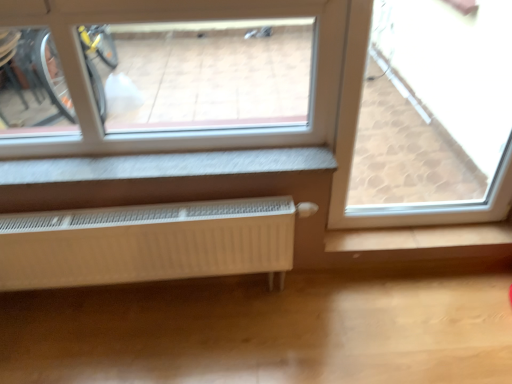
Question: Do you think white matte radiator at lower center is within transparent glass window at upper right, or outside of it?

Choices:
 (A) outside
 (B) inside

Answer: (A)

Question: Looking at the image, does white matte radiator at lower center seem bigger or smaller compared to transparent glass window at upper right?

Choices:
 (A) big
 (B) small

Answer: (B)

Question: From the image's perspective, is white matte radiator at lower center above or below transparent glass window at upper right?

Choices:
 (A) above
 (B) below

Answer: (B)

Question: Is transparent glass window at upper right taller or shorter than white matte radiator at lower center?

Choices:
 (A) short
 (B) tall

Answer: (B)

Question: Based on their sizes in the image, would you say transparent glass window at upper right is bigger or smaller than white matte radiator at lower center?

Choices:
 (A) big
 (B) small

Answer: (A)

Question: From the image's perspective, is transparent glass window at upper right positioned above or below white matte radiator at lower center?

Choices:
 (A) below
 (B) above

Answer: (B)

Question: In the image, is transparent glass window at upper right on the left side or the right side of white matte radiator at lower center?

Choices:
 (A) left
 (B) right

Answer: (B)